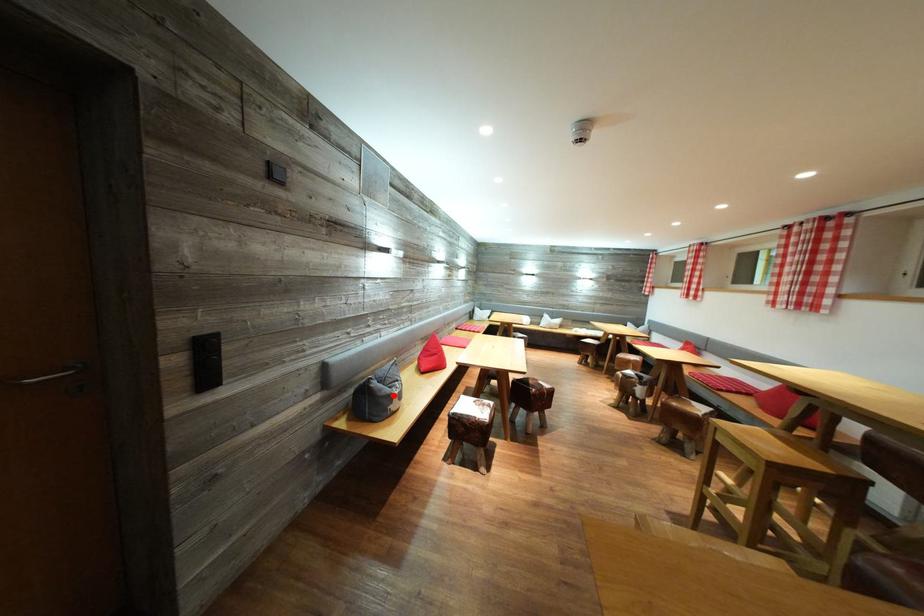
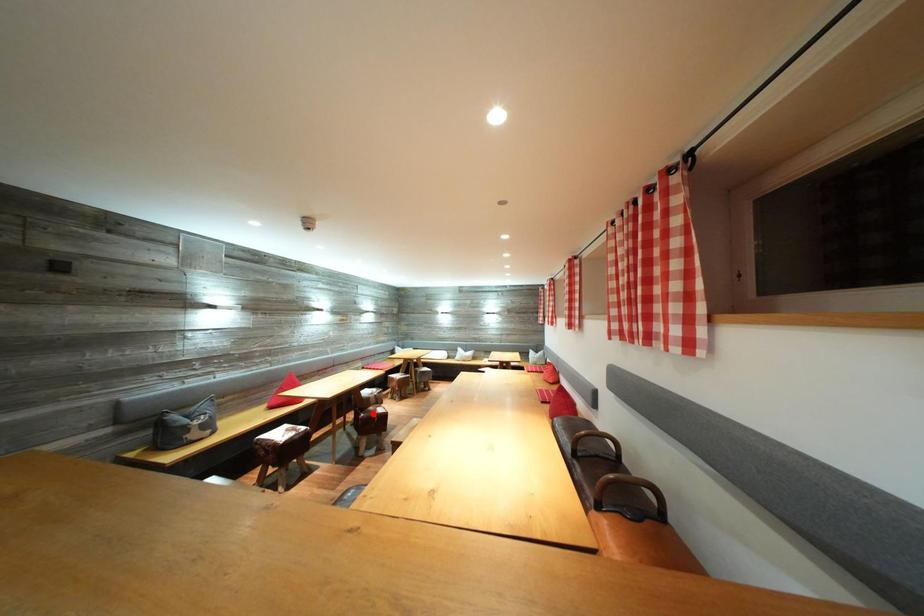
I am providing you with two images of the same scene from different viewpoints. A red point is marked on the first image and another point is marked on the second image. Is the marked point in image1 the same physical position as the marked point in image2?

No